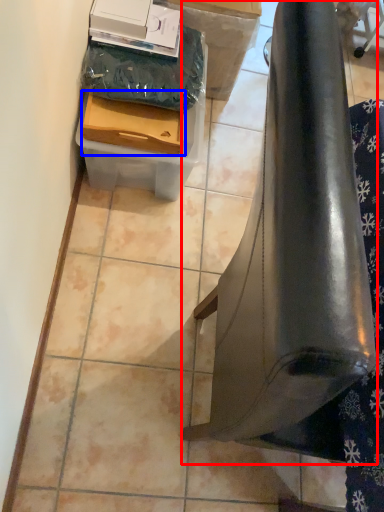
Question: Which object appears closest to the camera in this image, furniture (highlighted by a red box) or box (highlighted by a blue box)?

Choices:
 (A) furniture
 (B) box

Answer: (A)